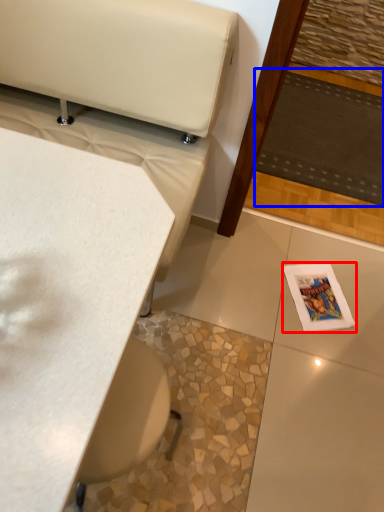
Question: Among these objects, which one is farthest to the camera, magazine (highlighted by a red box) or mat (highlighted by a blue box)?

Choices:
 (A) magazine
 (B) mat

Answer: (B)